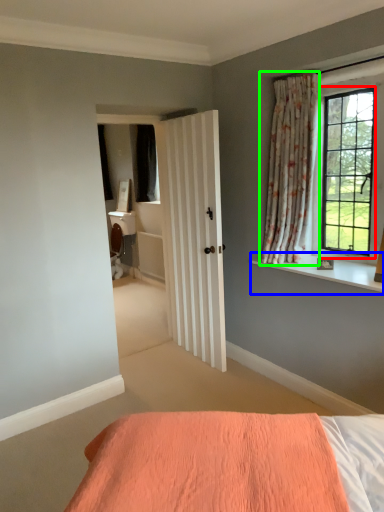
Question: Considering the real-world distances, which object is closest to window (highlighted by a red box)? window sill (highlighted by a blue box) or curtain (highlighted by a green box).

Choices:
 (A) window sill
 (B) curtain

Answer: (B)